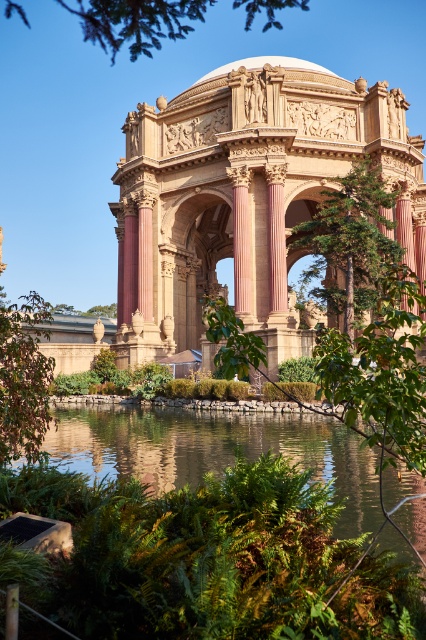
Does golden stone palace at center appear on the left side of clear water at center?

Incorrect, golden stone palace at center is not on the left side of clear water at center.

Does golden stone palace at center have a smaller size compared to clear water at center?

No, golden stone palace at center is not smaller than clear water at center.

Find the location of a particular element. golden stone palace at center is located at coordinates (245, 195).

This screenshot has height=640, width=426. What do you see at coordinates (351, 241) in the screenshot? I see `green leafy tree at center` at bounding box center [351, 241].

Who is more forward, (394, 225) or (0, 348)?

Point (0, 348) is in front.

Between point (371, 260) and point (20, 369), which one is positioned in front?

Positioned in front is point (20, 369).

You are a GUI agent. You are given a task and a screenshot of the screen. Output one action in this format:
    pyautogui.click(x=<x>, y=<y>)
    Task: Click on the green leafy tree at center
    The height and width of the screenshot is (640, 426).
    Given the screenshot: What is the action you would take?
    coord(351,241)

What do you see at coordinates (23, 378) in the screenshot? I see `green leafy tree at lower left` at bounding box center [23, 378].

Does green leafy tree at lower left have a lesser width compared to green leafy tree at upper center?

Indeed, green leafy tree at lower left has a lesser width compared to green leafy tree at upper center.

Which is behind, point (37, 381) or point (118, 35)?

Positioned behind is point (118, 35).

The image size is (426, 640). Find the location of `green leafy tree at lower left`. green leafy tree at lower left is located at coordinates (23, 378).